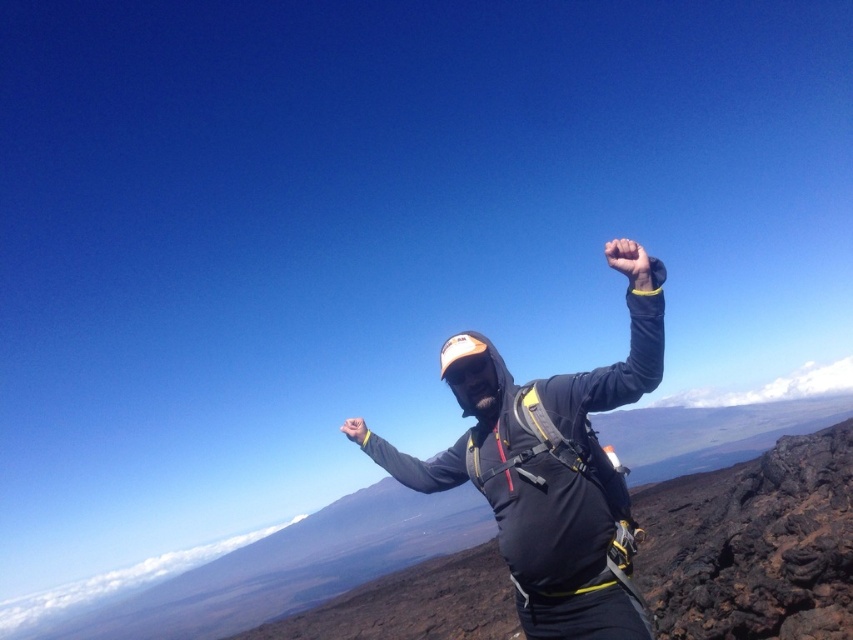
You are a hiker who has reached the summit and wants to place two markers at the coordinates provided. Given the volcanic landscape described, can you determine which marker, point 1 at (430, 465) or point 2 at (628, 266), is farther from your current position at the summit?

Point 1 at (430, 465) is behind point 2 at (628, 266), so point 1 is farther from your current position at the summit.

You are a photographer trying to capture the climber in the scene. You notice the black fabric jacket at center and the yellow fabric hand at center. Which object should you focus on first to ensure both are in the frame without moving the camera?

You should focus on the black fabric jacket at center first because the yellow fabric hand at center is behind it, so by focusing on the front object, both will be in the frame.